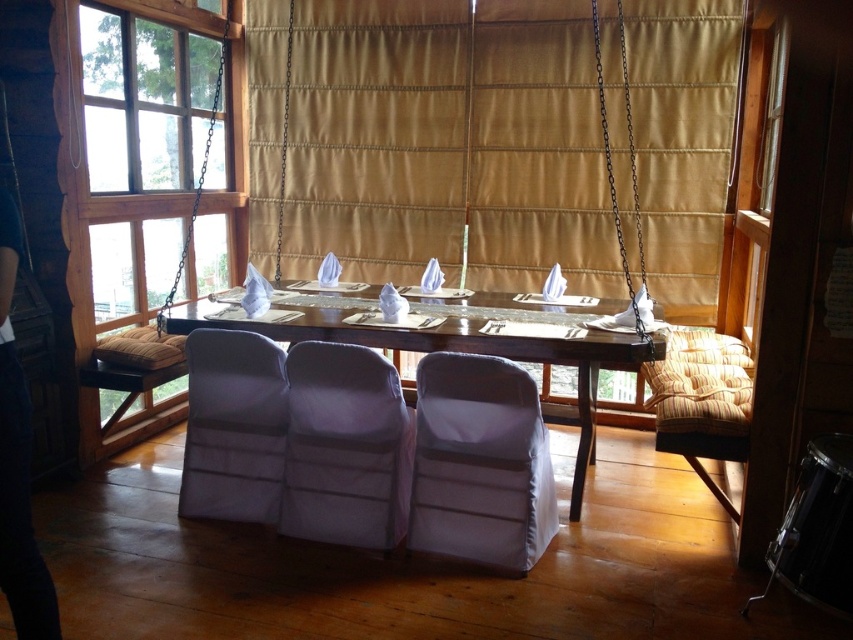
Can you confirm if white fabric armchair at center is positioned below gold fabric curtain at center?

Yes, white fabric armchair at center is below gold fabric curtain at center.

What do you see at coordinates (345, 448) in the screenshot? Image resolution: width=853 pixels, height=640 pixels. I see `white fabric armchair at center` at bounding box center [345, 448].

At what (x,y) coordinates should I click in order to perform the action: click on white fabric armchair at center. Please return your answer as a coordinate pair (x, y). Looking at the image, I should click on (345, 448).

The width and height of the screenshot is (853, 640). In order to click on white fabric armchair at center in this screenshot , I will do `click(345, 448)`.

Between point (218, 433) and point (607, 140), which one is positioned in front?

Point (218, 433) is in front.

Does matte white armchair at center appear under gold fabric curtain at center?

Yes.

Image resolution: width=853 pixels, height=640 pixels. Describe the element at coordinates (233, 428) in the screenshot. I see `matte white armchair at center` at that location.

Find the location of a particular element. matte white armchair at center is located at coordinates (233, 428).

Which of these two, wooden table at center or matte white armchair at center, stands shorter?

matte white armchair at center

Is wooden table at center bigger than matte white armchair at center?

Indeed, wooden table at center has a larger size compared to matte white armchair at center.

This screenshot has width=853, height=640. What do you see at coordinates (461, 346) in the screenshot? I see `wooden table at center` at bounding box center [461, 346].

I want to click on wooden table at center, so click(461, 346).